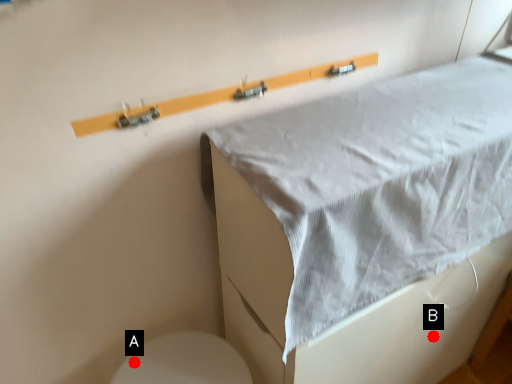
Question: Two points are circled on the image, labeled by A and B beside each circle. Which point is closer to the camera?

Choices:
 (A) A is closer
 (B) B is closer

Answer: (A)